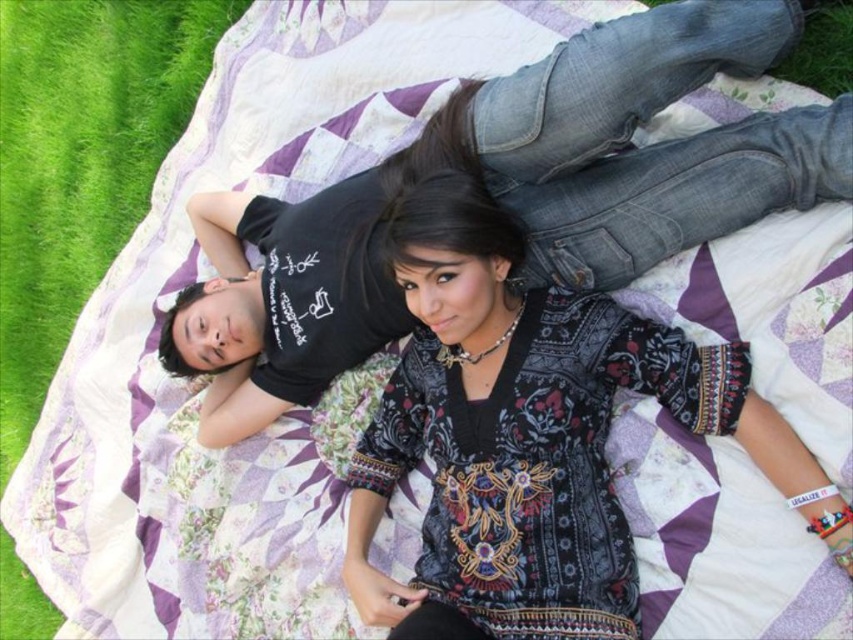
Is patterned fabric dress at center above green grass at left?

No, patterned fabric dress at center is not above green grass at left.

Does point (596, 588) lie in front of point (7, 74)?

Yes, point (596, 588) is in front of point (7, 74).

Does point (397, 621) come behind point (96, 253)?

That is False.

Locate an element on the screen. This screenshot has width=853, height=640. patterned fabric dress at center is located at coordinates (532, 435).